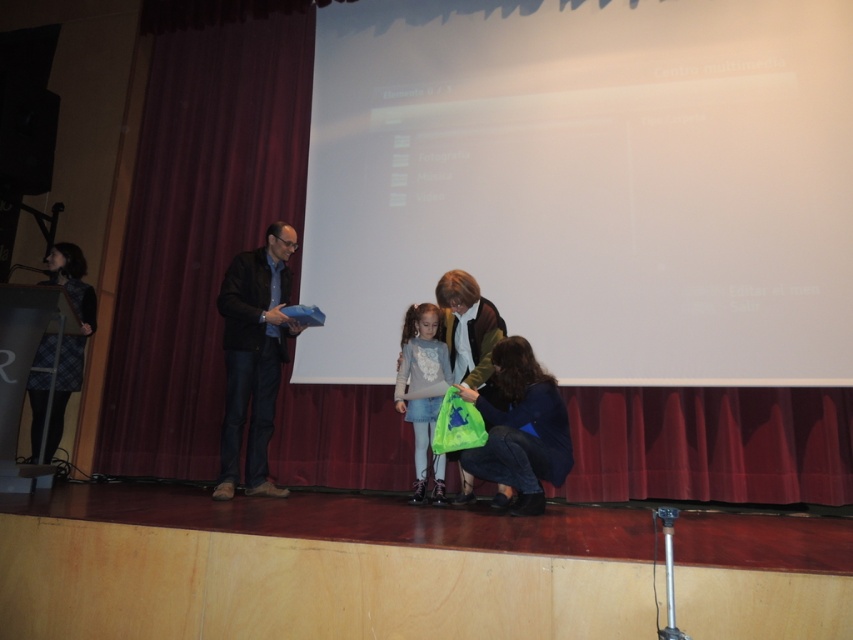
In the scene shown: Is green fabric bag at lower center in front of plaid fabric dress at left?

Yes, it is.

Can you confirm if green fabric bag at lower center is bigger than plaid fabric dress at left?

No.

I want to click on green fabric bag at lower center, so click(x=521, y=428).

Does white matte projection screen at center have a smaller size compared to dark brown leather jacket at center?

Actually, white matte projection screen at center might be larger than dark brown leather jacket at center.

Between point (711, 342) and point (260, 365), which one is positioned in front?

Point (711, 342) is more forward.

Find the location of `white matte projection screen at center`. white matte projection screen at center is located at coordinates (589, 182).

Image resolution: width=853 pixels, height=640 pixels. What do you see at coordinates (199, 218) in the screenshot? I see `maroon velvet curtain at left` at bounding box center [199, 218].

Measure the distance between maroon velvet curtain at left and matte gray sweater at center.

maroon velvet curtain at left and matte gray sweater at center are 6.64 feet apart.

Locate an element on the screen. The height and width of the screenshot is (640, 853). maroon velvet curtain at left is located at coordinates (199, 218).